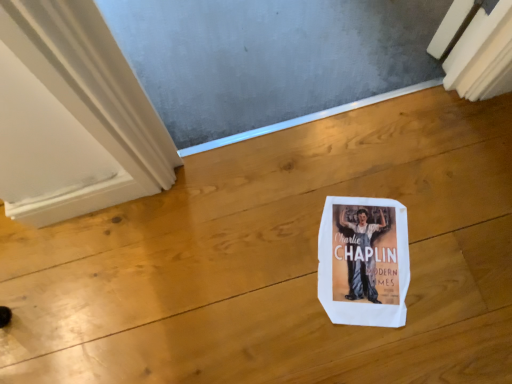
This screenshot has width=512, height=384. What do you see at coordinates (364, 261) in the screenshot?
I see `white paper bag at center` at bounding box center [364, 261].

The height and width of the screenshot is (384, 512). I want to click on white paper bag at center, so click(x=364, y=261).

In order to face white paper bag at center, should I rotate leftwards or rightwards?

To face it directly, rotate right by 14.851 degrees.

Find the location of a particular element. Image resolution: width=512 pixels, height=384 pixels. white paper bag at center is located at coordinates (364, 261).